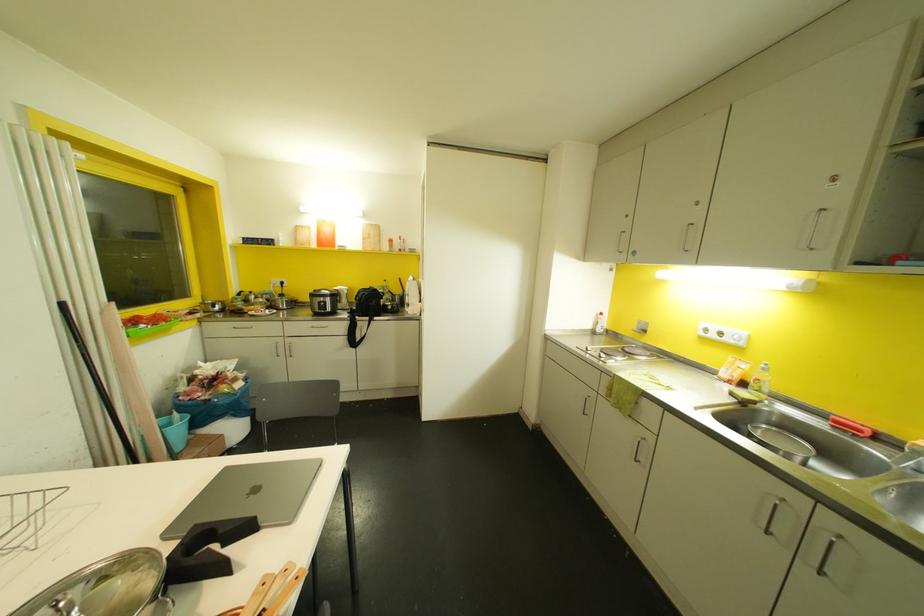
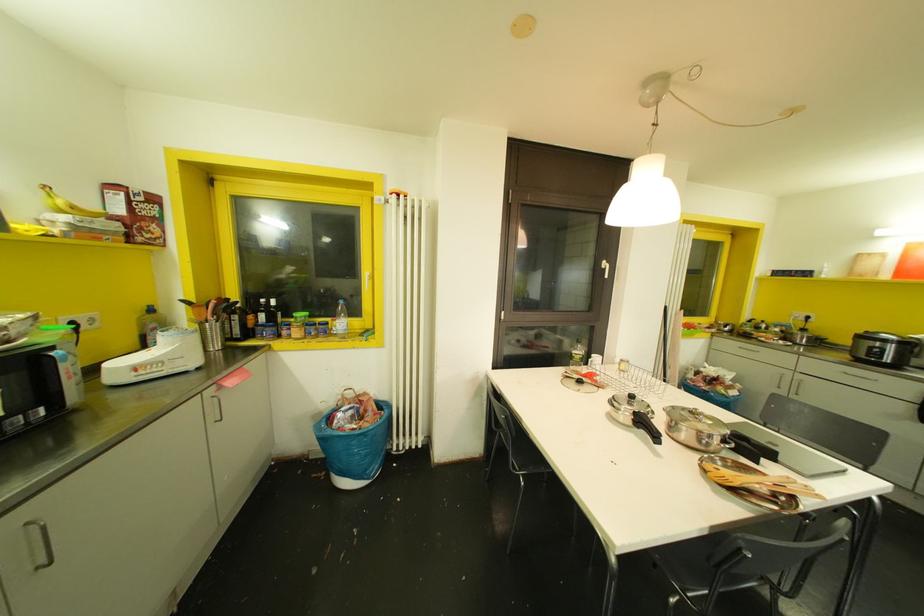
Where in the second image is the point corresponding to point 312,294 from the first image?

(861, 336)